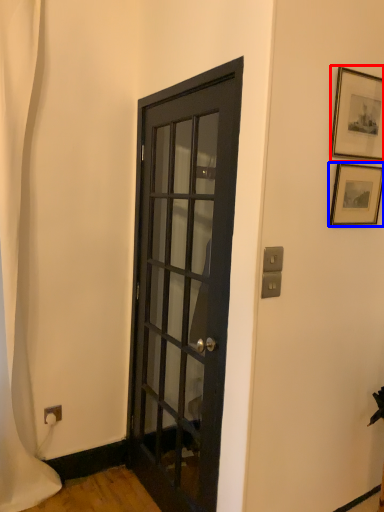
Question: Which of the following is the farthest to the observer, picture frame (highlighted by a red box) or picture frame (highlighted by a blue box)?

Choices:
 (A) picture frame
 (B) picture frame

Answer: (B)